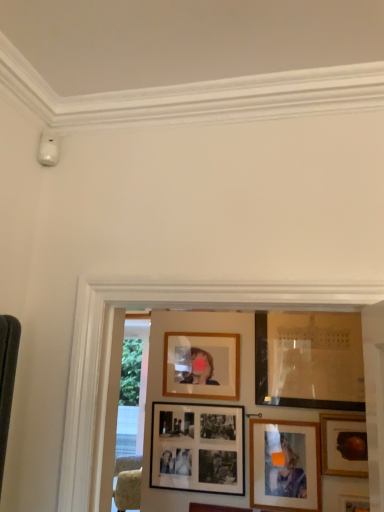
Question: From the image's perspective, is wooden photo frame at lower right, marked as the first picture frame in a bottom-to-top arrangement, positioned above or below matte wooden picture frame at lower right, which appears as the 2th picture frame when ordered from the bottom?

Choices:
 (A) above
 (B) below

Answer: (B)

Question: From their relative heights in the image, would you say wooden photo frame at lower right, which is the 6th picture frame in top-to-bottom order, is taller or shorter than matte wooden picture frame at lower right, the 5th picture frame from the top?

Choices:
 (A) tall
 (B) short

Answer: (B)

Question: Which object is the farthest from the matte glass picture frame at upper right, which ranks as the 1th picture frame in top-to-bottom order?

Choices:
 (A) wooden frame at upper center, which is counted as the 2th picture frame, starting from the top
 (B) matte wooden picture frame at lower right, the 5th picture frame from the top
 (C) wooden photo frame at lower right, marked as the first picture frame in a bottom-to-top arrangement
 (D) gold-framed painting at lower right, which appears as the third picture frame when viewed from the top
 (E) black matte picture frame at center, placed as the third picture frame when sorted from bottom to top

Answer: (C)

Question: Based on their relative distances, which object is nearer to the wooden frame at upper center, which is counted as the 2th picture frame, starting from the top?

Choices:
 (A) black matte picture frame at center, acting as the 4th picture frame starting from the top
 (B) matte wooden picture frame at lower right, which appears as the 2th picture frame when ordered from the bottom
 (C) matte glass picture frame at upper right, which ranks as the 1th picture frame in top-to-bottom order
 (D) gold-framed painting at lower right, the 4th picture frame from the bottom
 (E) wooden photo frame at lower right, marked as the first picture frame in a bottom-to-top arrangement

Answer: (A)